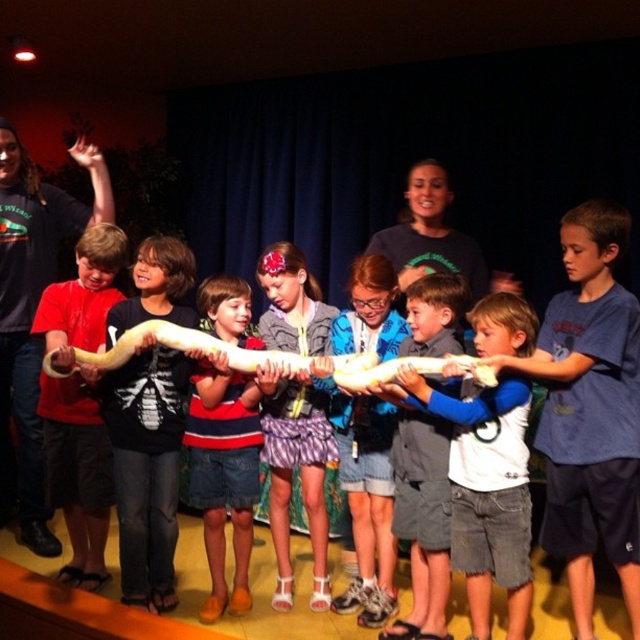
From the picture: How distant is white matte vest at center from plaid skirt at center?

The distance of white matte vest at center from plaid skirt at center is 29.46 inches.

Between point (449, 477) and point (314, 596), which one is positioned behind?

The point (314, 596) is behind.

Between point (468, 608) and point (276, 468), which one is positioned behind?

The point (276, 468) is more distant.

You are a GUI agent. You are given a task and a screenshot of the screen. Output one action in this format:
    pyautogui.click(x=<x>, y=<y>)
    Task: Click on the white matte vest at center
    Image resolution: width=640 pixels, height=640 pixels.
    Given the screenshot: What is the action you would take?
    pyautogui.click(x=484, y=490)

Between matte red shirt at left and striped cotton shirt at center, which one is positioned higher?

matte red shirt at left is above.

In the scene shown: Can you confirm if matte red shirt at left is positioned below striped cotton shirt at center?

No.

Who is more distant from viewer, (x=88, y=572) or (x=241, y=596)?

Point (x=88, y=572)

Locate an element on the screen. matte red shirt at left is located at coordinates (77, 472).

Does white matte vest at center appear over matte red shirt at left?

No.

Is point (483, 406) in front of point (54, 438)?

Yes, point (483, 406) is closer to viewer.

The width and height of the screenshot is (640, 640). In order to click on white matte vest at center in this screenshot , I will do `click(484, 490)`.